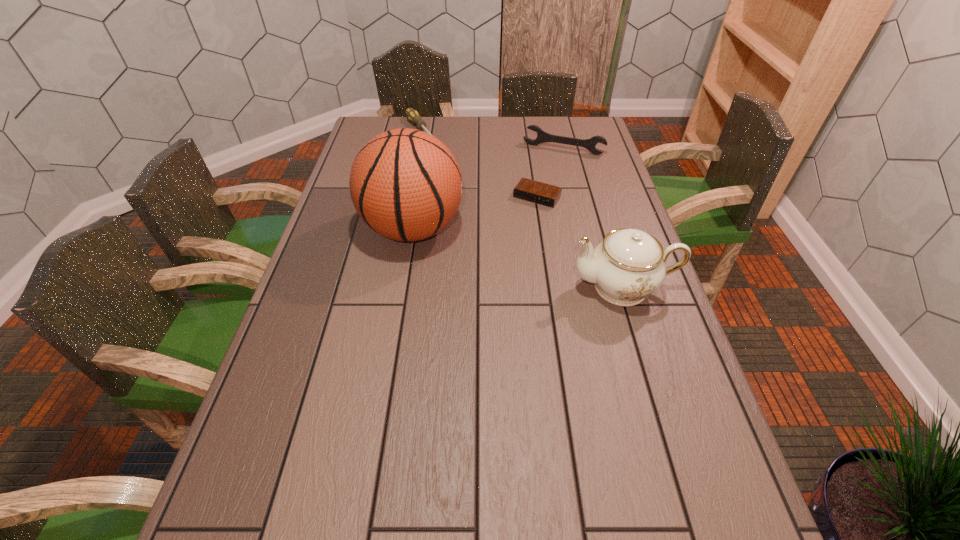
Locate an element on the screen. The image size is (960, 540). vacant space in between the alarm clock and the chinaware is located at coordinates (580, 242).

Where is `vacant point located between the chinaware and the alarm clock`? The width and height of the screenshot is (960, 540). vacant point located between the chinaware and the alarm clock is located at coordinates (580, 242).

You are a GUI agent. You are given a task and a screenshot of the screen. Output one action in this format:
    pyautogui.click(x=<x>, y=<y>)
    Task: Click on the vacant area that lies between the alarm clock and the wrench
    The width and height of the screenshot is (960, 540).
    Given the screenshot: What is the action you would take?
    pyautogui.click(x=550, y=173)

Locate an element on the screen. The height and width of the screenshot is (540, 960). free point between the shortest object and the third shortest object is located at coordinates tap(550, 173).

At what (x,y) coordinates should I click in order to perform the action: click on free space between the third tallest object and the basketball. Please return your answer as a coordinate pair (x, y). The height and width of the screenshot is (540, 960). Looking at the image, I should click on (488, 189).

This screenshot has height=540, width=960. In order to click on vacant space that is in between the chinaware and the tallest object in this screenshot , I will do `click(518, 258)`.

Identify the location of free space between the second tallest object and the tallest object. This screenshot has width=960, height=540. (518, 258).

Locate an element on the screen. free space between the alarm clock and the second tallest object is located at coordinates (580, 242).

Locate an element on the screen. This screenshot has height=540, width=960. unoccupied position between the third shortest object and the tallest object is located at coordinates (488, 189).

Find the location of a particular element. The image size is (960, 540). object that stands as the fourth closest to the shortest object is located at coordinates (413, 116).